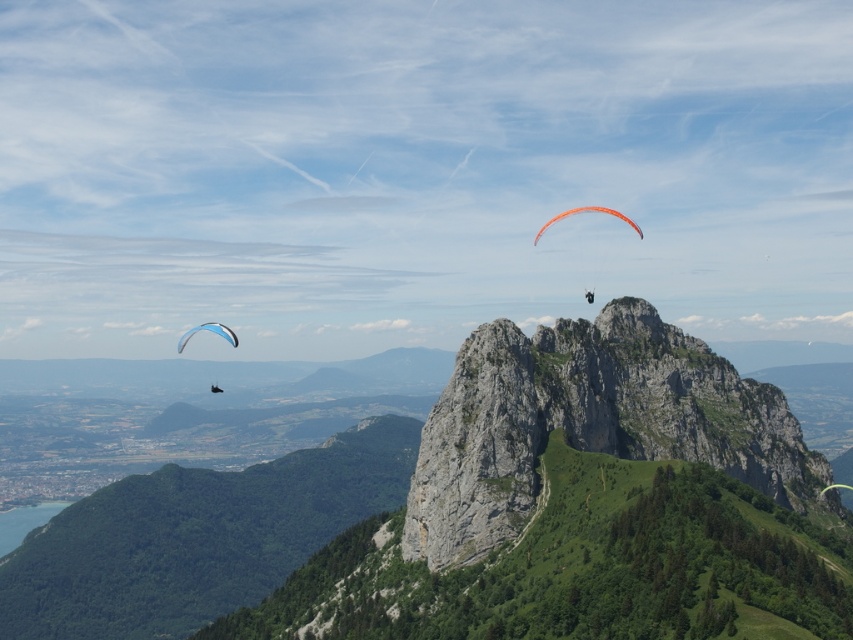
Question: Among these objects, which one is farthest from the camera?

Choices:
 (A) rugged stone mountain at center
 (B) orange fabric parachute at center
 (C) blue fabric parachute at lower left

Answer: (B)

Question: Based on their relative distances, which object is farther from the rugged stone mountain at center?

Choices:
 (A) orange fabric parachute at center
 (B) blue fabric parachute at lower left

Answer: (A)

Question: Can you confirm if rugged stone mountain at center is thinner than orange fabric parachute at center?

Choices:
 (A) no
 (B) yes

Answer: (A)

Question: Which of the following is the farthest from the observer?

Choices:
 (A) (212, 321)
 (B) (660, 392)

Answer: (A)

Question: Can you confirm if rugged stone mountain at center is positioned below blue fabric parachute at lower left?

Choices:
 (A) yes
 (B) no

Answer: (A)

Question: Does rugged stone mountain at center have a larger size compared to orange fabric parachute at center?

Choices:
 (A) yes
 (B) no

Answer: (A)